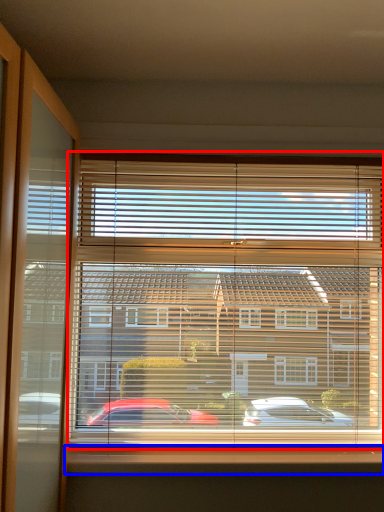
Question: Which of the following is the closest to the observer, window blind (highlighted by a red box) or window sill (highlighted by a blue box)?

Choices:
 (A) window blind
 (B) window sill

Answer: (B)